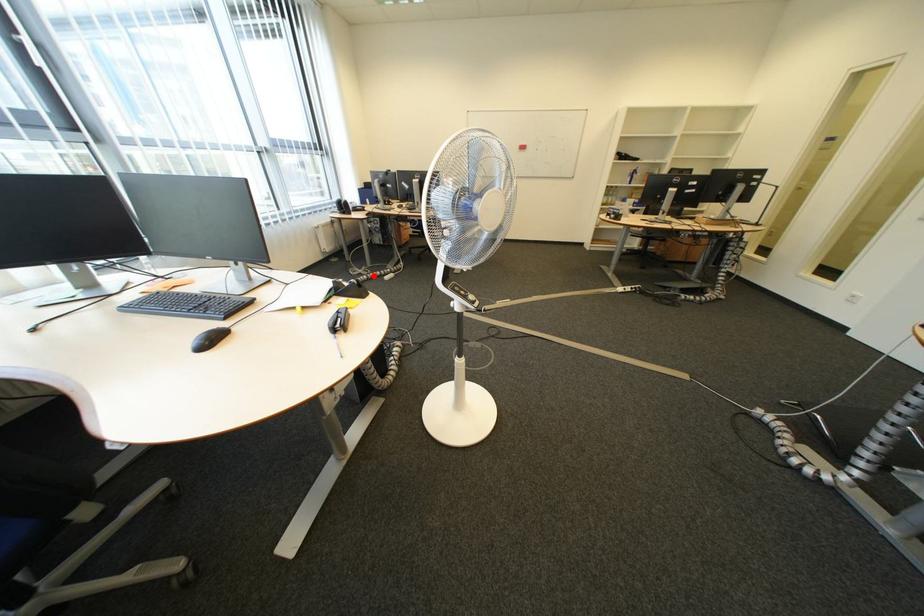
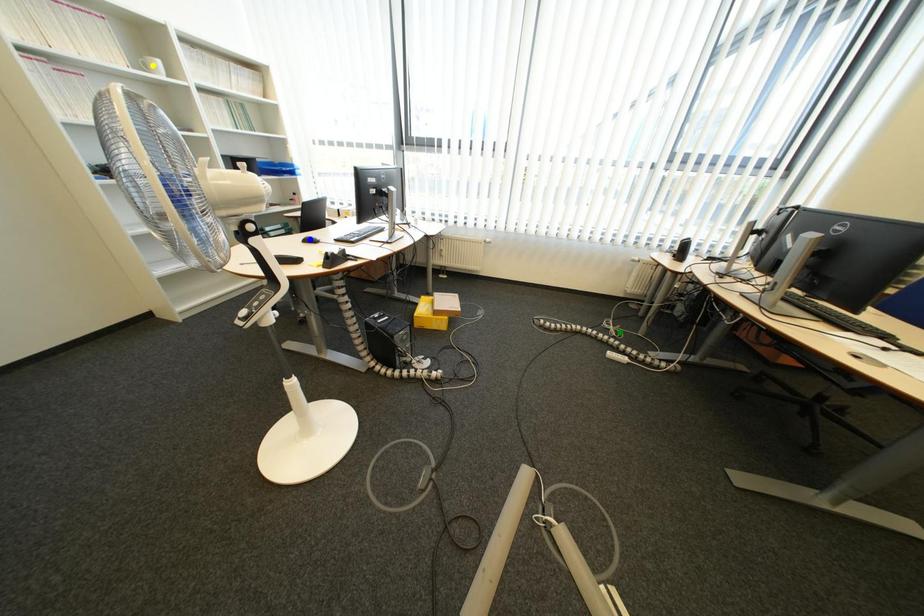
Question: I am providing you with two images of the same scene from different viewpoints. A red point is marked on the first image. You are given multiple points on the second image. Which mark in image 2 goes with the point in image 1?

Choices:
 (A) green point
 (B) yellow point
 (C) blue point

Answer: (A)